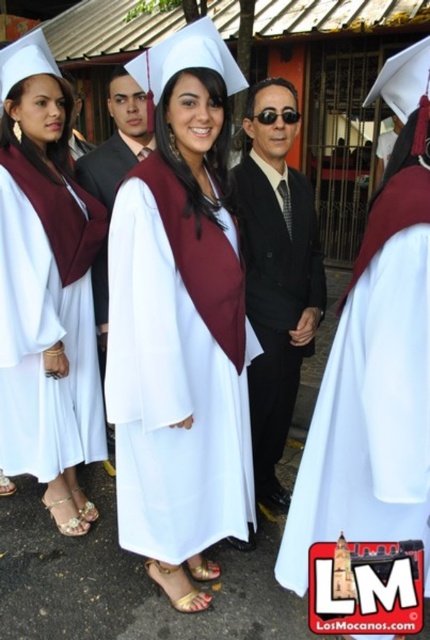
In the scene shown: You are planning to rent a costume for a play. The scene requires two characters side by side. The first character wears a white matte graduation gown at center and the second a shiny black suit at center. Which costume requires a larger size?

The white matte graduation gown at center requires a larger size because its width is greater than the shiny black suit at center.

You are a photographer at a graduation ceremony. You need to decide which clothing item to focus on for a closeup shot. The white matte graduation gown at center and the shiny black suit at center are both in your frame. Which one would you choose if you want to capture the larger clothing item?

The white matte graduation gown at center is larger in size than the shiny black suit at center, so you should focus on the white matte graduation gown at center for the closeup shot.